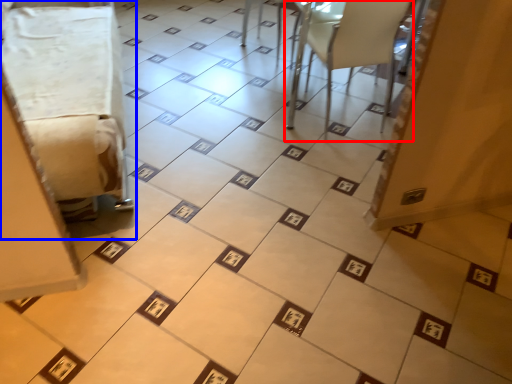
Question: Which object is closer to the camera taking this photo, furniture (highlighted by a red box) or furniture (highlighted by a blue box)?

Choices:
 (A) furniture
 (B) furniture

Answer: (B)